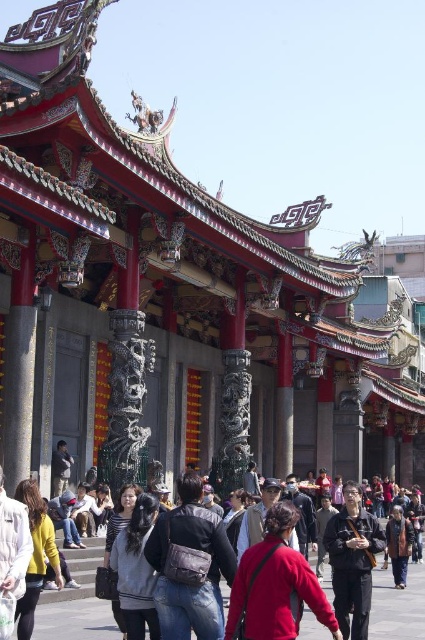
Is dark gray fabric jacket at center wider than yellow sweater at center?

Indeed, dark gray fabric jacket at center has a greater width compared to yellow sweater at center.

Does dark gray fabric jacket at center appear over yellow sweater at center?

No, dark gray fabric jacket at center is not above yellow sweater at center.

At what (x,y) coordinates should I click in order to perform the action: click on dark gray fabric jacket at center. Please return your answer as a coordinate pair (x, y). The width and height of the screenshot is (425, 640). Looking at the image, I should click on (353, 561).

Where is `dark gray fabric jacket at center`? The image size is (425, 640). dark gray fabric jacket at center is located at coordinates (353, 561).

Which of these two, dark gray hoodie at center or brown textured coat at lower right, stands shorter?

With less height is dark gray hoodie at center.

Is point (127, 637) closer to viewer compared to point (401, 557)?

Yes, point (127, 637) is in front of point (401, 557).

Where is `dark gray hoodie at center`? dark gray hoodie at center is located at coordinates (136, 570).

Can you confirm if red matte jacket at center is wider than yellow sweater at center?

Yes, red matte jacket at center is wider than yellow sweater at center.

Is point (265, 589) positioned in front of point (22, 636)?

That is True.

This screenshot has width=425, height=640. In order to click on red matte jacket at center in this screenshot , I will do `click(275, 586)`.